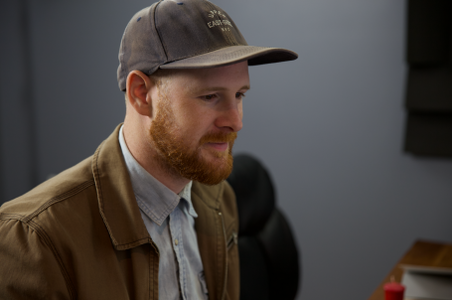
Locate an element on the screen. Image resolution: width=452 pixels, height=300 pixels. office chair is located at coordinates (265, 209).